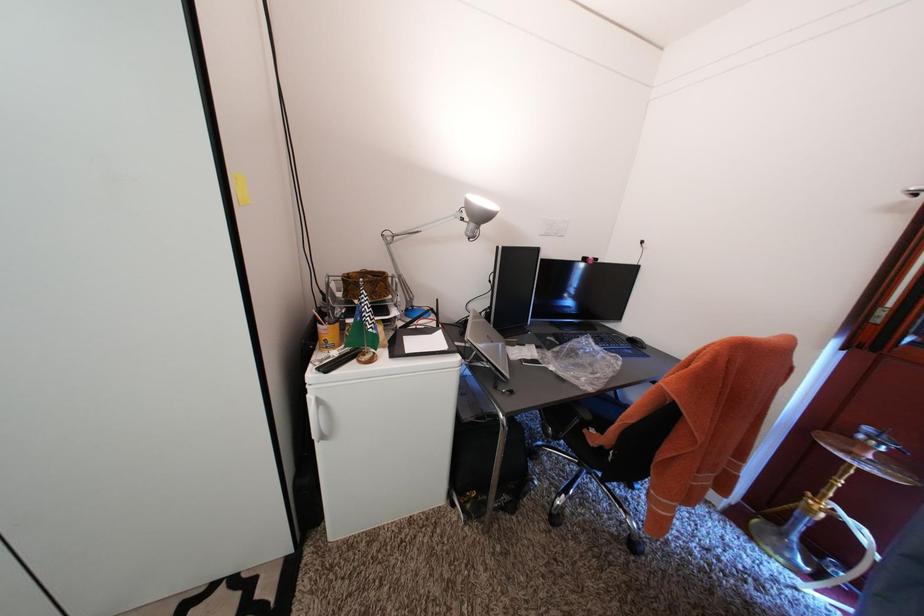
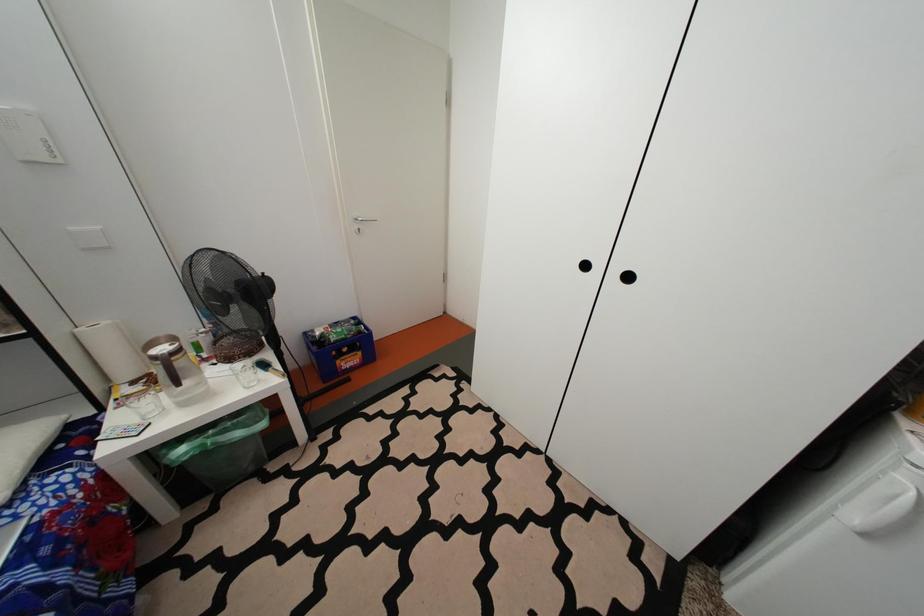
Question: The camera is either moving clockwise (left) or counter-clockwise (right) around the object. The first image is from the beginning of the video and the second image is from the end. Is the camera moving left or right when shooting the video?

Choices:
 (A) Left
 (B) Right

Answer: (B)